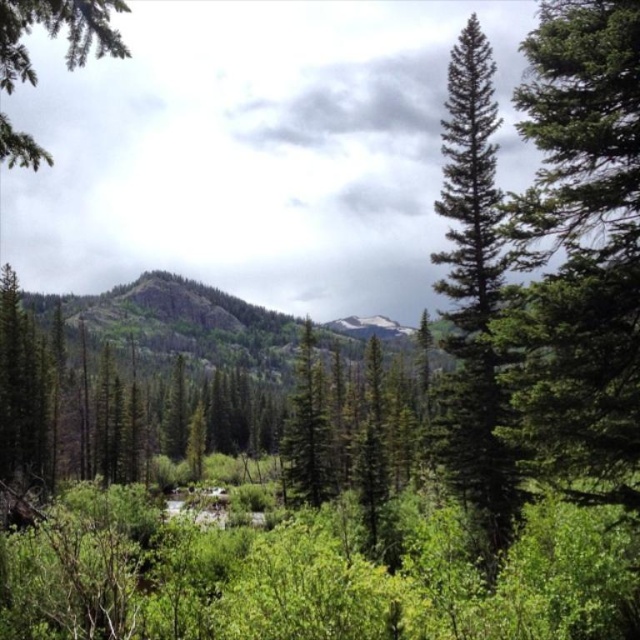
Question: Based on their relative distances, which object is nearer to the green matte tree at center?

Choices:
 (A) green textured rock at center
 (B) green needle-like tree at center-right

Answer: (B)

Question: Does green textured rock at center have a smaller size compared to green matte tree at center?

Choices:
 (A) yes
 (B) no

Answer: (B)

Question: Which point appears farthest from the camera in this image?

Choices:
 (A) (490, 156)
 (B) (321, 451)

Answer: (B)

Question: Which of the following is the closest to the observer?

Choices:
 (A) green matte tree at center
 (B) green needle-like tree at center-right
 (C) green textured rock at center

Answer: (B)

Question: Can you confirm if green needle-like tree at center-right is positioned to the left of green textured rock at center?

Choices:
 (A) yes
 (B) no

Answer: (B)

Question: Is green needle-like tree at center-right thinner than green matte tree at center?

Choices:
 (A) no
 (B) yes

Answer: (A)